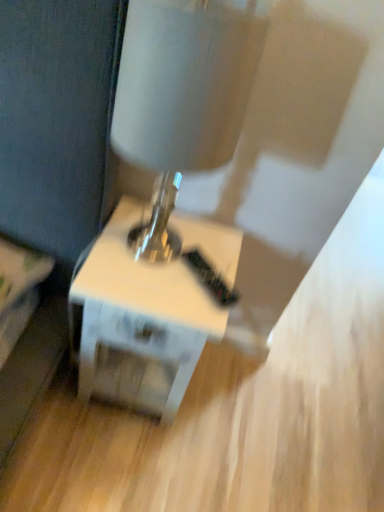
Find the location of a particular element. This screenshot has width=384, height=512. free space below metallic silver table lamp at center (from a real-world perspective) is located at coordinates (151, 244).